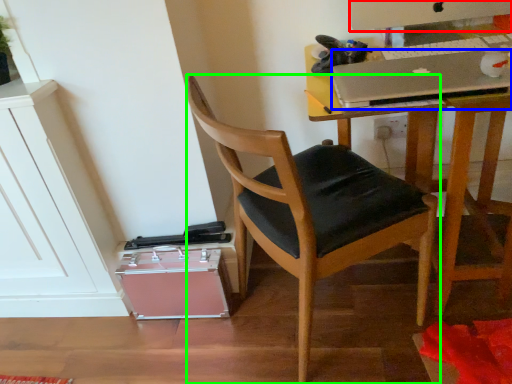
Question: Considering the real-world distances, which object is closest to computer monitor (highlighted by a red box)? laptop (highlighted by a blue box) or chair (highlighted by a green box).

Choices:
 (A) laptop
 (B) chair

Answer: (A)